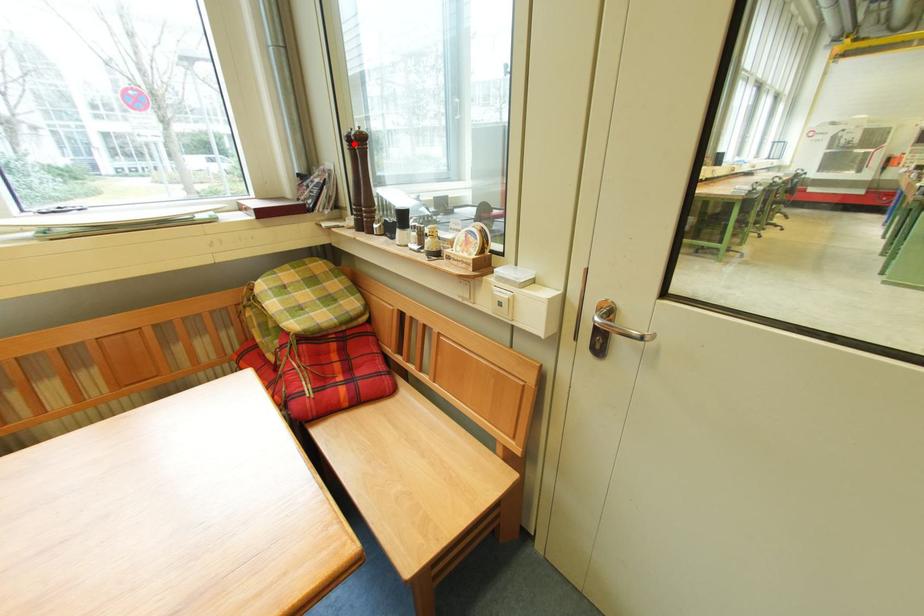
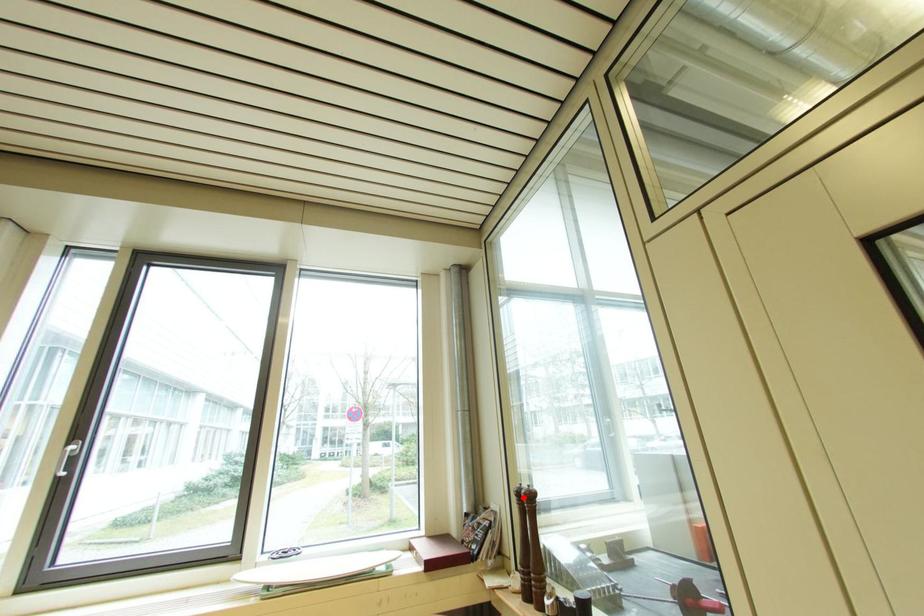
I am providing you with two images of the same scene from different viewpoints. A red point is marked on the first image and another point is marked on the second image. Does the point marked in image1 correspond to the same location as the one in image2?

Yes